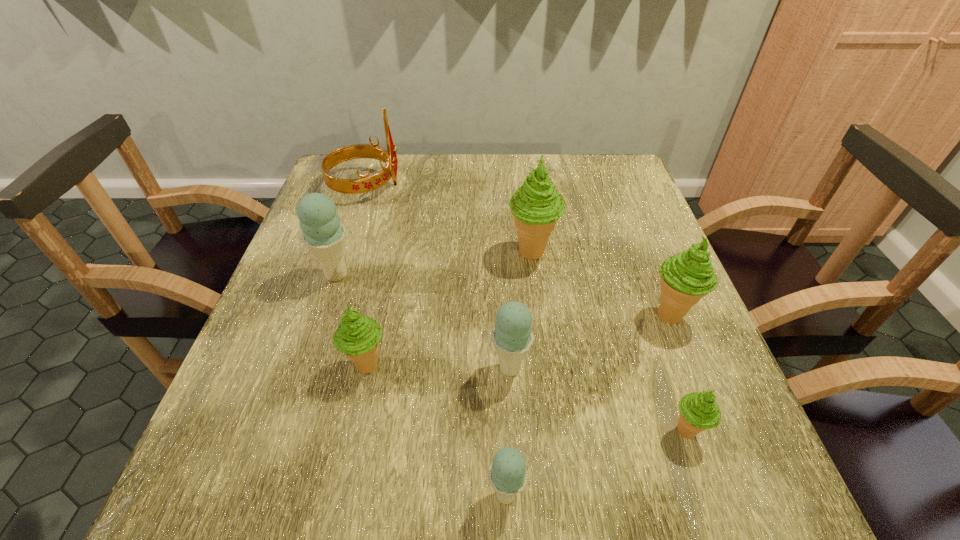
Find the location of a particular element. The width and height of the screenshot is (960, 540). blue ice cream that stands as the third closest to the second smallest green icecream is located at coordinates (508, 475).

The image size is (960, 540). Find the location of `vacant point that satisfies the following two spatial constraints: 1. on the front-facing side of the red tiara; 2. on the left side of the leftmost ice cream`. vacant point that satisfies the following two spatial constraints: 1. on the front-facing side of the red tiara; 2. on the left side of the leftmost ice cream is located at coordinates (336, 275).

Identify the location of vacant area that satisfies the following two spatial constraints: 1. on the front-facing side of the tiara; 2. on the left side of the biggest blue ice cream. The height and width of the screenshot is (540, 960). (336, 275).

Find the location of a particular element. This screenshot has width=960, height=540. vacant space that satisfies the following two spatial constraints: 1. on the front-facing side of the red tiara; 2. on the right side of the tallest ice cream is located at coordinates (344, 253).

Where is `free location that satisfies the following two spatial constraints: 1. on the front-facing side of the second green icecream from left to right; 2. on the left side of the tiara`? This screenshot has height=540, width=960. free location that satisfies the following two spatial constraints: 1. on the front-facing side of the second green icecream from left to right; 2. on the left side of the tiara is located at coordinates (344, 253).